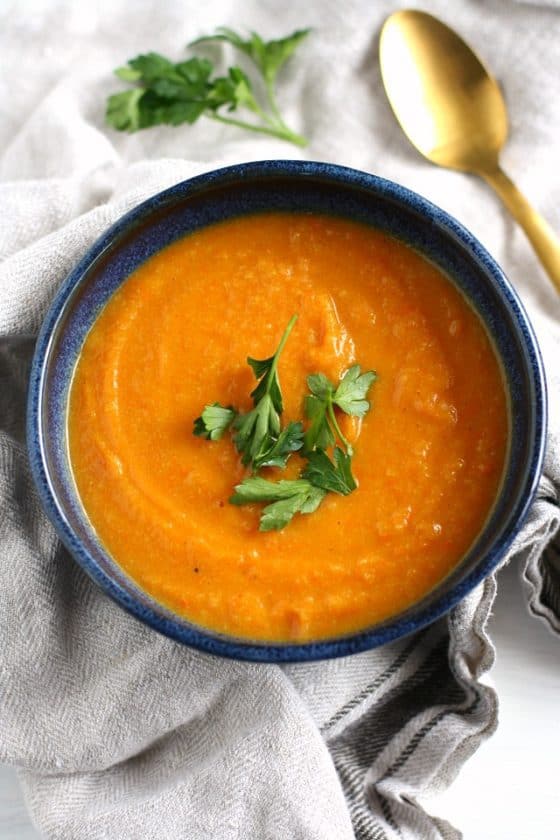
Identify the location of round blue bowl. The height and width of the screenshot is (840, 560). (284, 169).